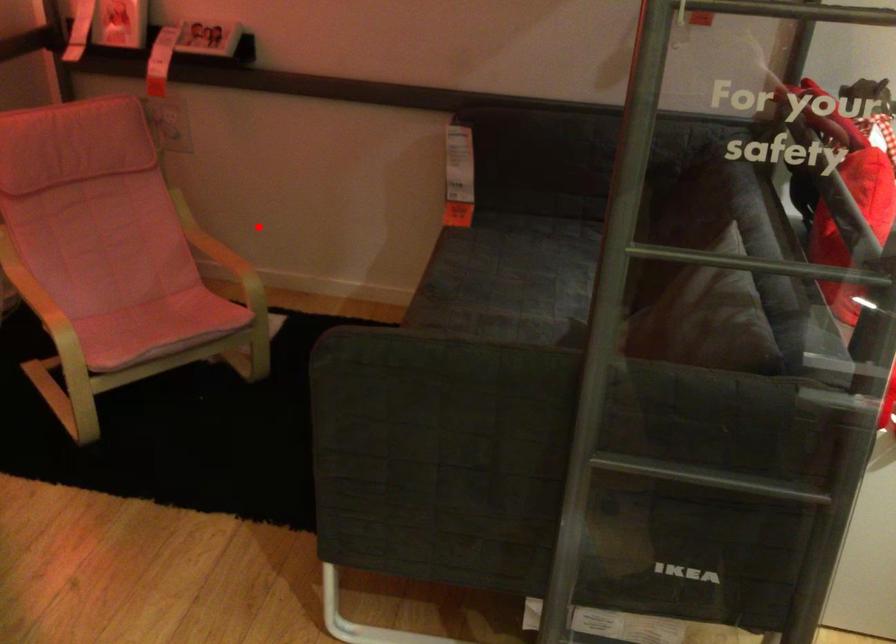
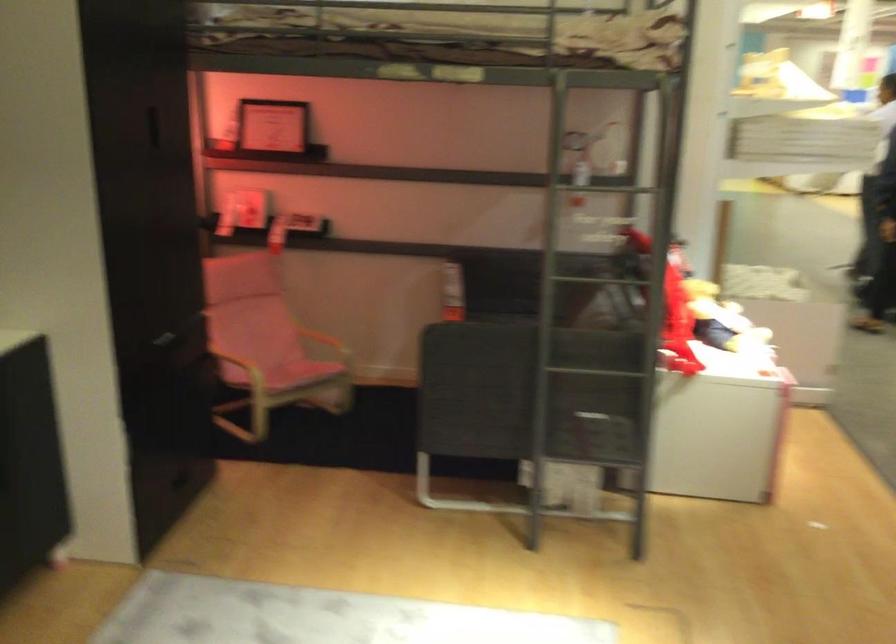
The point at the highlighted location is marked in the first image. Where is the corresponding point in the second image?

(332, 328)